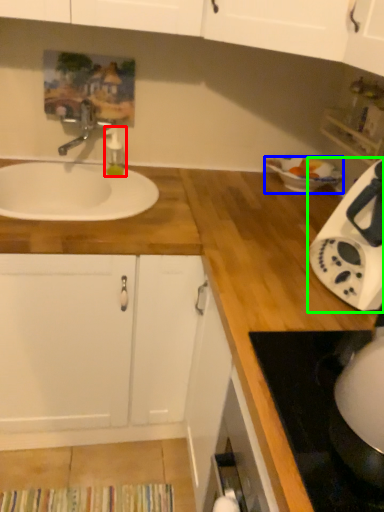
Question: Estimate the real-world distances between objects in this image. Which object is closer to soap dispenser (highlighted by a red box), basin (highlighted by a blue box) or home appliance (highlighted by a green box)?

Choices:
 (A) basin
 (B) home appliance

Answer: (A)